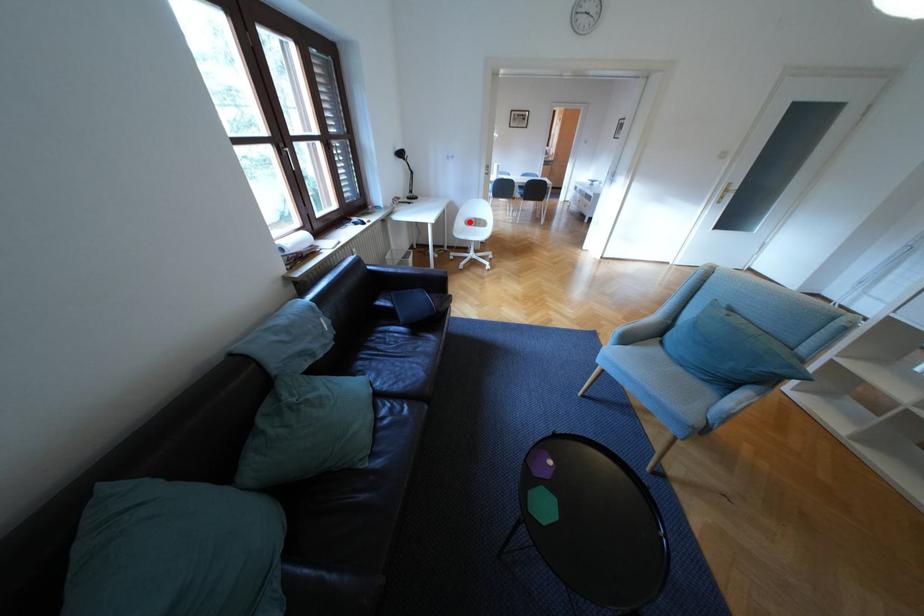
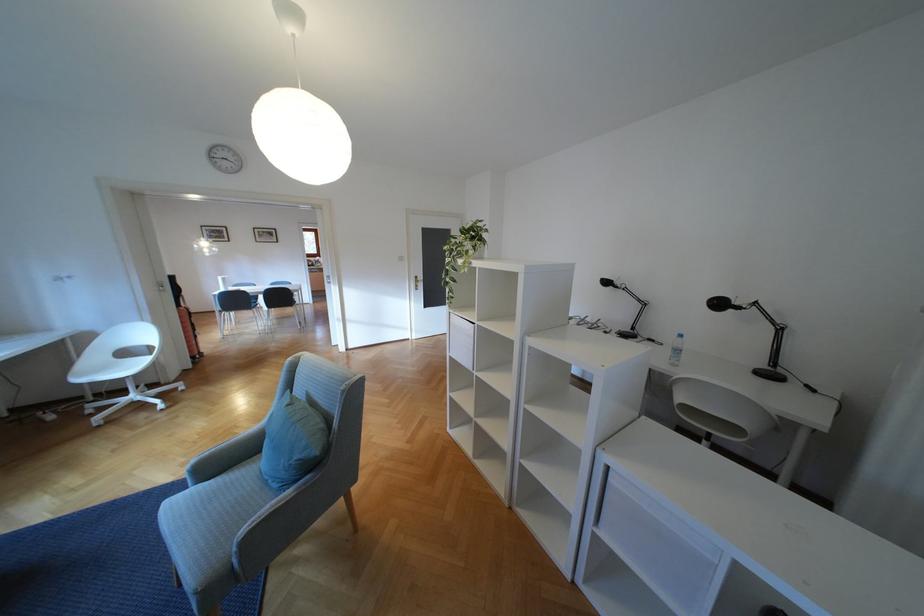
Find the pixel in the second image that matches the highlighted location in the first image.

(104, 358)